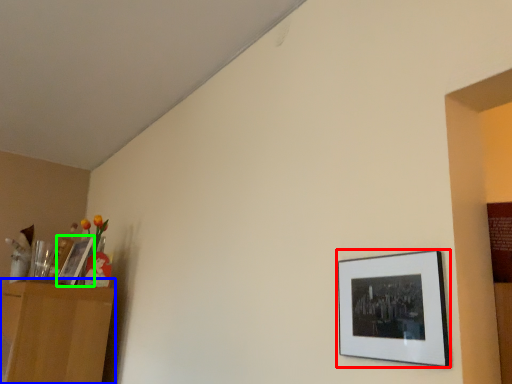
Question: Based on their relative distances, which object is nearer to picture frame (highlighted by a red box)? Choose from dresser (highlighted by a blue box) and picture frame (highlighted by a green box).

Choices:
 (A) dresser
 (B) picture frame

Answer: (A)